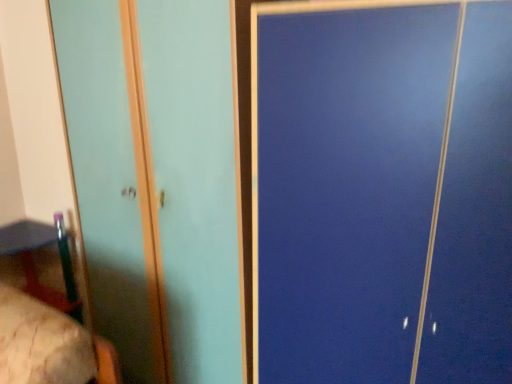
Question: Is matte teal screen door at left positioned with its back to wooden bed at lower left?

Choices:
 (A) no
 (B) yes

Answer: (B)

Question: From the image's perspective, would you say matte teal screen door at left is positioned over wooden bed at lower left?

Choices:
 (A) yes
 (B) no

Answer: (A)

Question: From the image's perspective, is matte teal screen door at left below wooden bed at lower left?

Choices:
 (A) no
 (B) yes

Answer: (A)

Question: Is matte teal screen door at left shorter than wooden bed at lower left?

Choices:
 (A) yes
 (B) no

Answer: (B)

Question: From a real-world perspective, is matte teal screen door at left over wooden bed at lower left?

Choices:
 (A) yes
 (B) no

Answer: (A)

Question: In the image, is wooden table at lower left on the left side or the right side of matte teal screen door at left?

Choices:
 (A) left
 (B) right

Answer: (A)

Question: In terms of height, does wooden table at lower left look taller or shorter compared to matte teal screen door at left?

Choices:
 (A) tall
 (B) short

Answer: (B)

Question: From the image's perspective, is wooden table at lower left above or below matte teal screen door at left?

Choices:
 (A) below
 (B) above

Answer: (A)

Question: Considering the positions of wooden table at lower left and matte teal screen door at left in the image, is wooden table at lower left bigger or smaller than matte teal screen door at left?

Choices:
 (A) small
 (B) big

Answer: (A)

Question: Looking at the image, does wooden bed at lower left seem bigger or smaller compared to wooden table at lower left?

Choices:
 (A) small
 (B) big

Answer: (A)

Question: From a real-world perspective, relative to wooden table at lower left, is wooden bed at lower left vertically above or below?

Choices:
 (A) above
 (B) below

Answer: (A)

Question: Considering the positions of point (46, 317) and point (46, 246), is point (46, 317) closer or farther from the camera than point (46, 246)?

Choices:
 (A) farther
 (B) closer

Answer: (B)

Question: Relative to wooden table at lower left, is wooden bed at lower left in front or behind?

Choices:
 (A) front
 (B) behind

Answer: (A)

Question: Does point (45, 296) appear closer or farther from the camera than point (47, 324)?

Choices:
 (A) closer
 (B) farther

Answer: (B)

Question: Considering the positions of wooden table at lower left and wooden bed at lower left in the image, is wooden table at lower left taller or shorter than wooden bed at lower left?

Choices:
 (A) short
 (B) tall

Answer: (B)